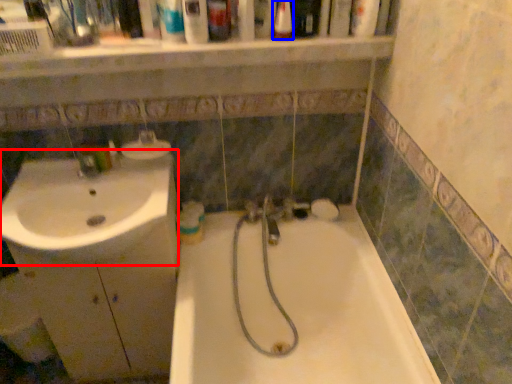
Question: Which object appears closest to the camera in this image, sink (highlighted by a red box) or mouthwash (highlighted by a blue box)?

Choices:
 (A) sink
 (B) mouthwash

Answer: (B)